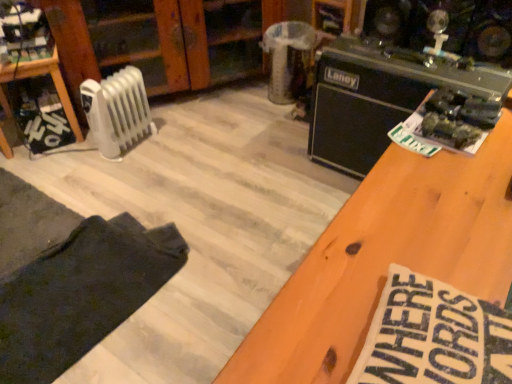
Question: Looking at the image, does dark cotton pants at lower left seem bigger or smaller compared to white plastic radiator at left?

Choices:
 (A) big
 (B) small

Answer: (A)

Question: From a real-world perspective, is dark cotton pants at lower left positioned above or below white plastic radiator at left?

Choices:
 (A) below
 (B) above

Answer: (A)

Question: Which object is the farthest from the white plastic radiator at left?

Choices:
 (A) dark cotton pants at lower left
 (B) wooden shelf at left
 (C) white plastic radiator at left
 (D) black matte amplifier at upper right

Answer: (A)

Question: Considering the real-world distances, which object is farthest from the white plastic radiator at left?

Choices:
 (A) dark cotton pants at lower left
 (B) black matte amplifier at upper right
 (C) wooden shelf at left
 (D) white plastic radiator at left

Answer: (A)